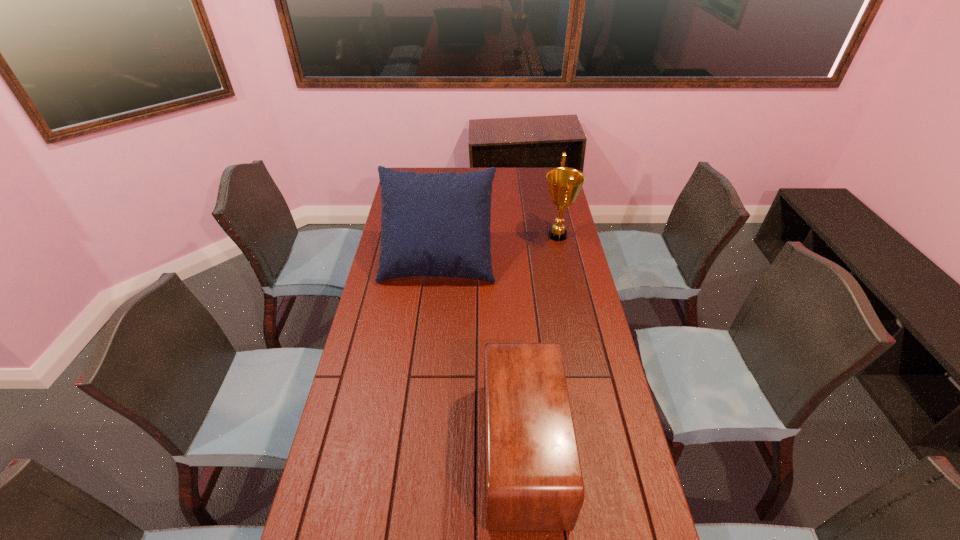
The image size is (960, 540). I want to click on vacant space located on the front panel of the nearest object, so tap(391, 451).

This screenshot has height=540, width=960. Identify the location of object at the left edge. (432, 224).

You are a GUI agent. You are given a task and a screenshot of the screen. Output one action in this format:
    pyautogui.click(x=<x>, y=<y>)
    Task: Click on the object located in the right edge section of the desktop
    
    Given the screenshot: What is the action you would take?
    pyautogui.click(x=564, y=183)

Where is `free region at the far edge of the desktop`? free region at the far edge of the desktop is located at coordinates (500, 171).

In the image, there is a desktop. At what (x,y) coordinates should I click in order to perform the action: click on vacant region at the left edge. Please return your answer as a coordinate pair (x, y). The width and height of the screenshot is (960, 540). Looking at the image, I should click on (386, 446).

Identify the location of free space at the right edge of the desktop. The image size is (960, 540). (598, 393).

Find the location of a particular element. The width and height of the screenshot is (960, 540). vacant space at the far right corner of the desktop is located at coordinates (545, 178).

Image resolution: width=960 pixels, height=540 pixels. I want to click on free space between the nearest object and the cushion, so click(x=480, y=355).

Image resolution: width=960 pixels, height=540 pixels. I want to click on vacant space that is in between the award and the cushion, so click(x=498, y=247).

The width and height of the screenshot is (960, 540). In order to click on vacant area that lies between the award and the cushion in this screenshot , I will do `click(498, 247)`.